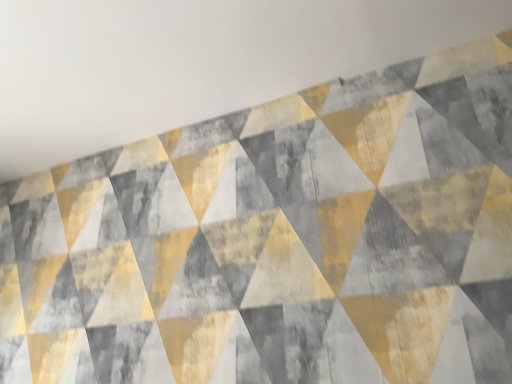
The width and height of the screenshot is (512, 384). What do you see at coordinates (193, 62) in the screenshot? I see `textured geometric wall at upper center` at bounding box center [193, 62].

What is the approximate height of textured geometric wall at upper center?

1.35 inches.

In order to click on textured geometric wall at upper center in this screenshot , I will do `click(193, 62)`.

In order to face textured geometric wall at upper center, should I rotate leftwards or rightwards?

Turn left approximately 16.640 degrees to face it.

Where is `textured geometric wall at upper center`? This screenshot has width=512, height=384. textured geometric wall at upper center is located at coordinates (193, 62).